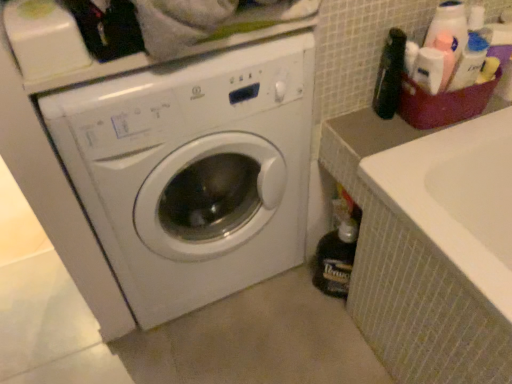
Where is `free space to the left of dark brown glass bottle at lower right, which is the 1th bottle from back to front`? The height and width of the screenshot is (384, 512). free space to the left of dark brown glass bottle at lower right, which is the 1th bottle from back to front is located at coordinates (292, 301).